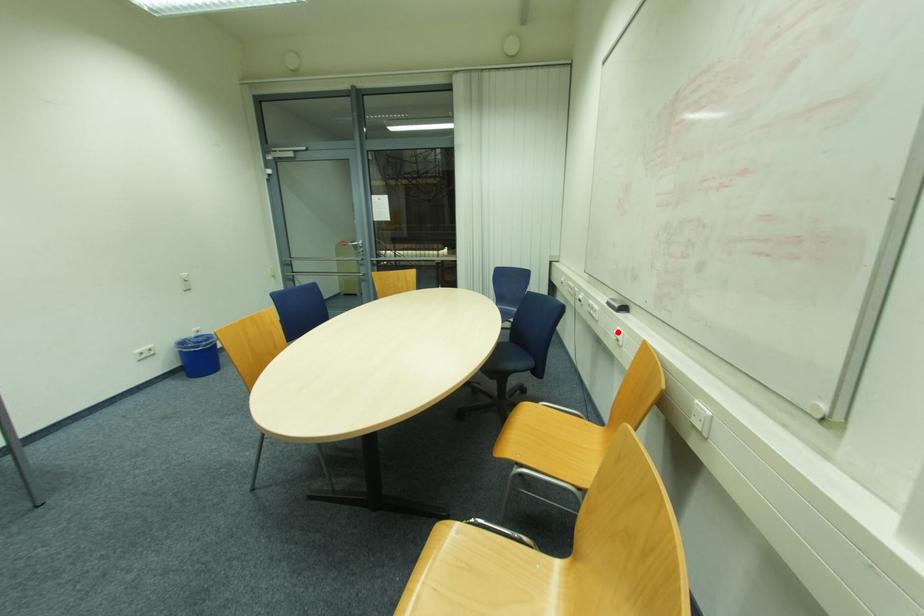
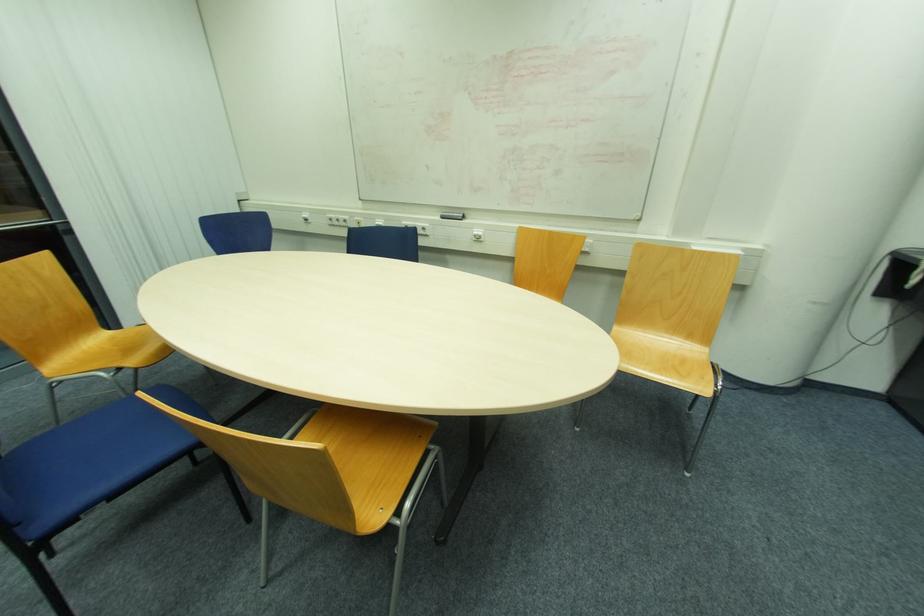
The point at the highlighted location is marked in the first image. Where is the corresponding point in the second image?

(477, 233)